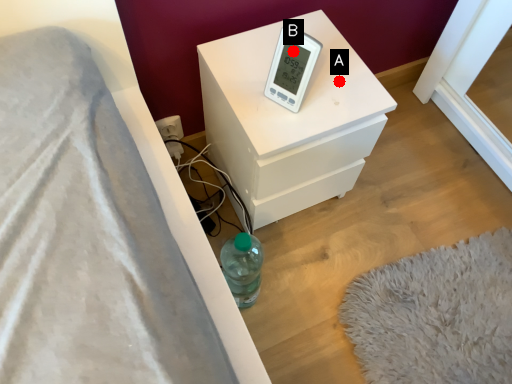
Question: Two points are circled on the image, labeled by A and B beside each circle. Which point is closer to the camera?

Choices:
 (A) A is closer
 (B) B is closer

Answer: (B)